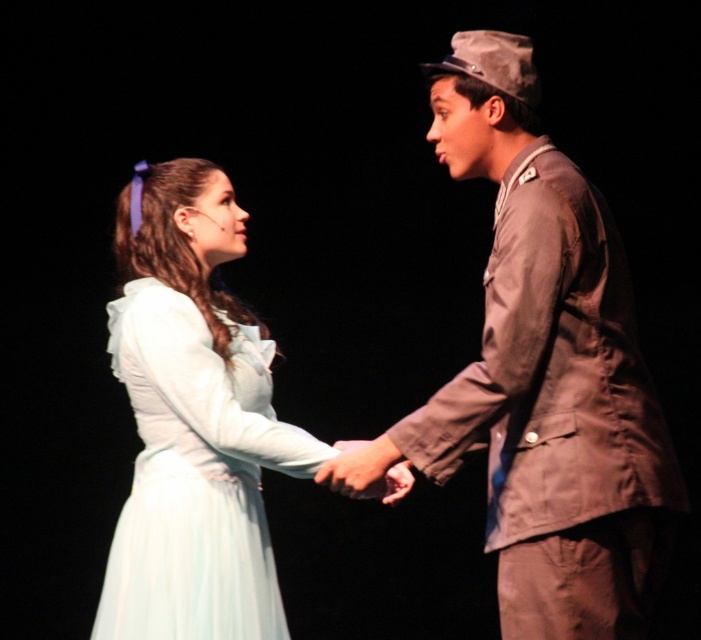
Question: Which point is closer to the camera?

Choices:
 (A) smooth skin hand at center
 (B) light blue satin dress at center
 (C) matte brown uniform at right

Answer: (C)

Question: Is light blue satin dress at center positioned before smooth skin hand at center?

Choices:
 (A) yes
 (B) no

Answer: (B)

Question: Which point appears closest to the camera in this image?

Choices:
 (A) (619, 364)
 (B) (336, 481)

Answer: (A)

Question: Is matte brown uniform at right wider than smooth skin hand at center?

Choices:
 (A) yes
 (B) no

Answer: (A)

Question: Which object appears closest to the camera in this image?

Choices:
 (A) matte brown uniform at right
 (B) light blue satin dress at center
 (C) smooth skin hand at center

Answer: (A)

Question: Is matte brown uniform at right above light blue satin dress at center?

Choices:
 (A) no
 (B) yes

Answer: (B)